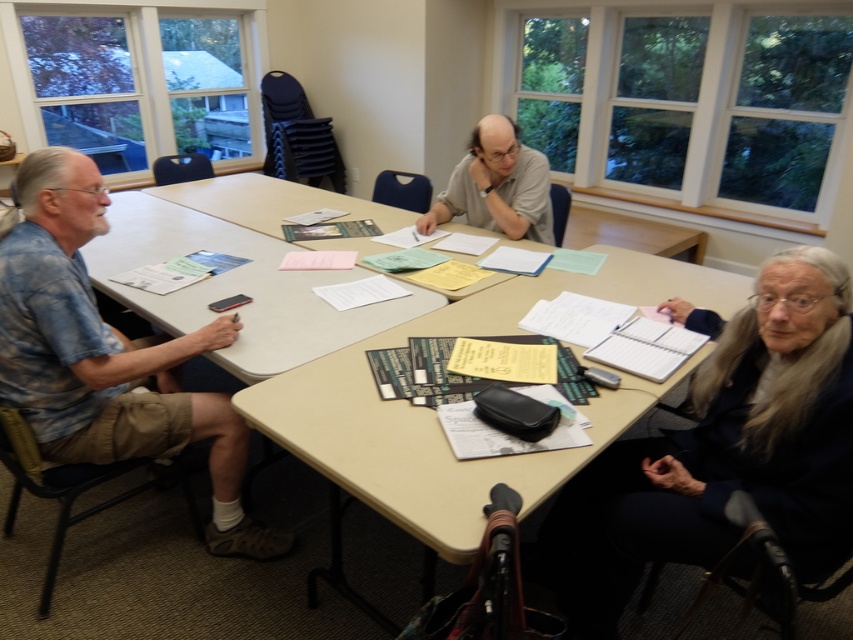
You are standing at the end of the table and want to hand a document to both the dark blue sweater at lower right and the matte gray shirt at center. Which person should you approach first to ensure you reach them in the shortest path?

You should approach the dark blue sweater at lower right first because they are closer to you than the matte gray shirt at center, so the shortest path is to them.